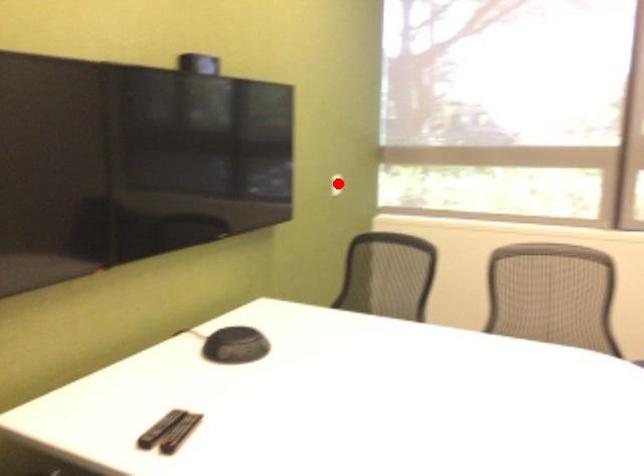
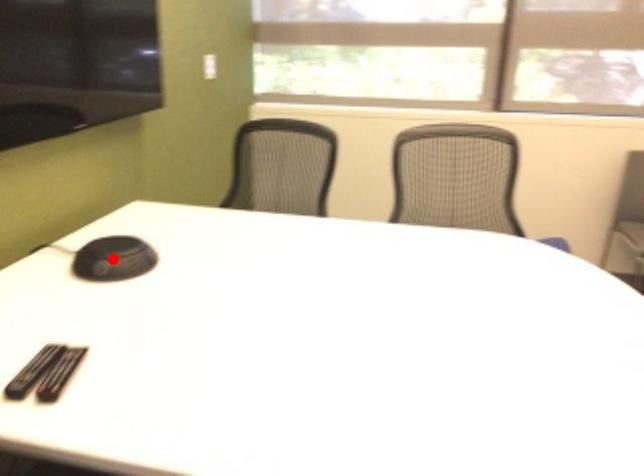
I am providing you with two images of the same scene from different viewpoints. A red point is marked on the first image and another point is marked on the second image. Is the marked point in image1 the same physical position as the marked point in image2?

No